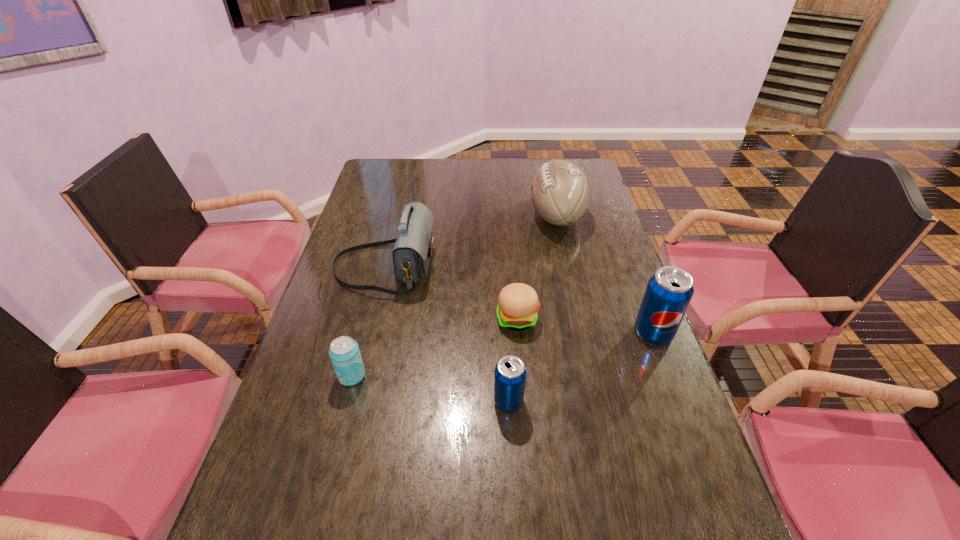
The image size is (960, 540). I want to click on vacant space that satisfies the following two spatial constraints: 1. on the laces of the rightmost object; 2. on the right side of the fifth object from left to right, so click(x=583, y=333).